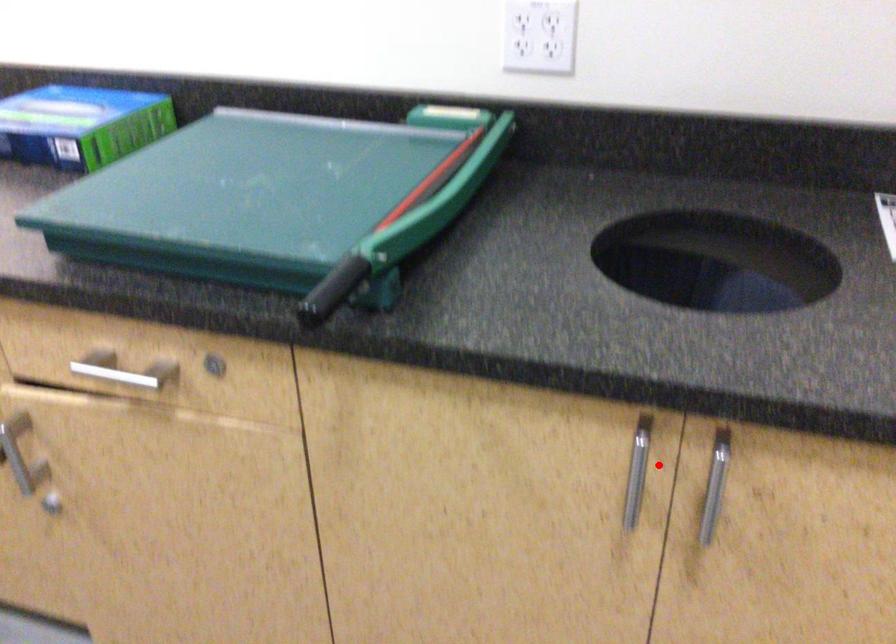
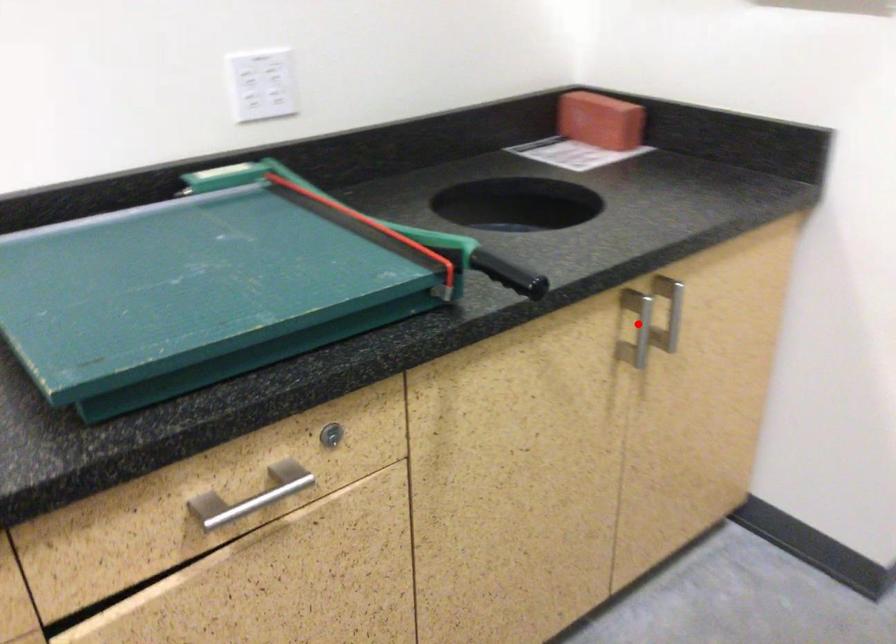
I am providing you with two images of the same scene from different viewpoints. A red point is marked on the first image and another point is marked on the second image. Is the marked point in image1 the same physical position as the marked point in image2?

Yes